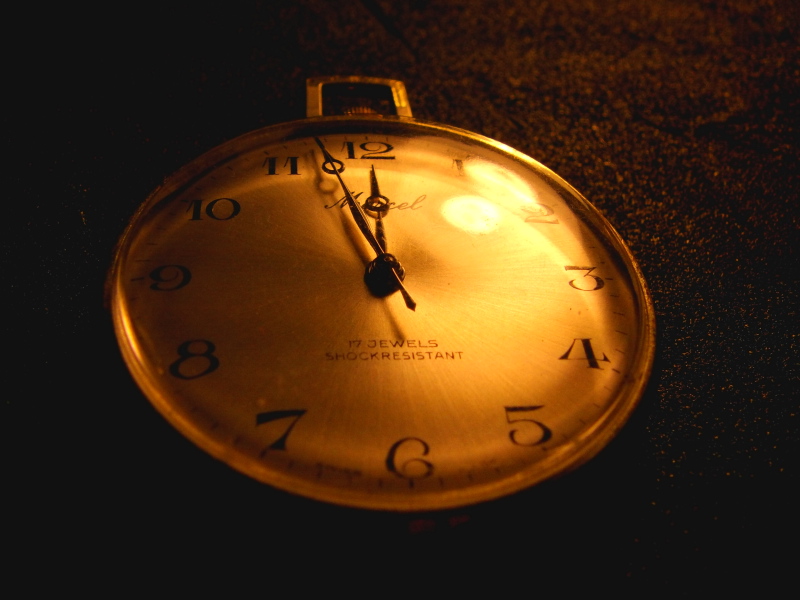
You are a GUI agent. You are given a task and a screenshot of the screen. Output one action in this format:
    pyautogui.click(x=<x>, y=<y>)
    Task: Click on the bright reflections on clock face
    This screenshot has width=800, height=600.
    Given the screenshot: What is the action you would take?
    pyautogui.click(x=501, y=182), pyautogui.click(x=474, y=215)